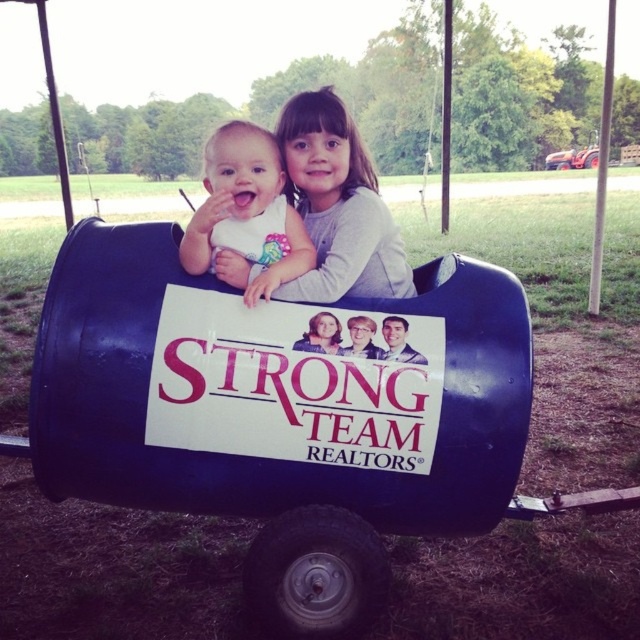
You are a photographer trying to capture the perfect shot of the gray soft shirt at upper center. Based on its 2D coordinates, where should you position your camera to ensure the shirt is centered in the frame?

The gray soft shirt at upper center is located at coordinates point (339, 205), so positioning the camera to center the frame at those coordinates would ensure the shirt is centered.

You are a photographer taking a picture of the two children in the wagon. You notice the gray soft shirt at upper center and the matte white bib at center. Which object is located to the right of the other?

The gray soft shirt at upper center is positioned on the right side of matte white bib at center.

Based on the photo, you are a photographer taking a picture of the gray soft shirt at upper center and the matte white bib at center. Which object should you focus on first if you want to capture both in the frame without moving the camera?

The gray soft shirt at upper center has a greater height compared to the matte white bib at center, so focusing on the gray soft shirt at upper center first would ensure both objects are in the frame without needing to adjust the camera position.